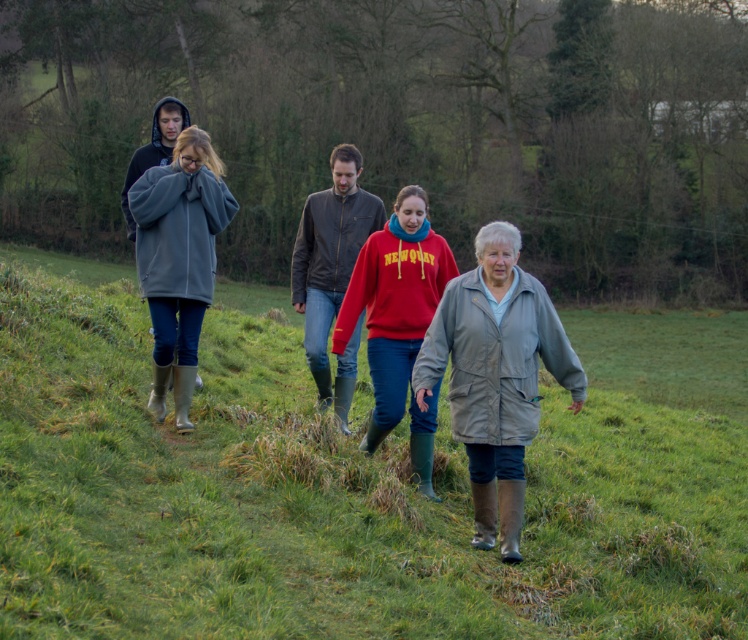
Question: Is gray matte jacket at center wider than red fleece sweater at center?

Choices:
 (A) yes
 (B) no

Answer: (A)

Question: Among these objects, which one is nearest to the camera?

Choices:
 (A) matte leather jacket at center
 (B) red fleece sweater at center

Answer: (B)

Question: Observing the image, what is the correct spatial positioning of green rubber boots at center in reference to matte gray coat at center?

Choices:
 (A) below
 (B) above

Answer: (A)

Question: Which point is closer to the camera?

Choices:
 (A) (423, 305)
 (B) (257, 492)
 (C) (156, 413)

Answer: (B)

Question: Observing the image, what is the correct spatial positioning of green rubber boots at center in reference to matte gray coat at center?

Choices:
 (A) below
 (B) above

Answer: (A)

Question: Which object appears farthest from the camera in this image?

Choices:
 (A) matte gray coat at center
 (B) green rubber boots at center

Answer: (A)